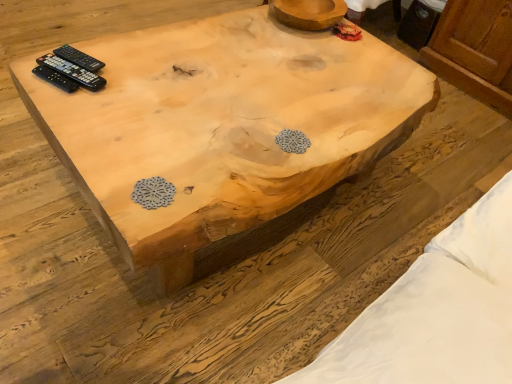
The width and height of the screenshot is (512, 384). In order to click on free space in front of black plastic remote at upper left, the 3th remote control when ordered from back to front in this screenshot , I will do `click(58, 104)`.